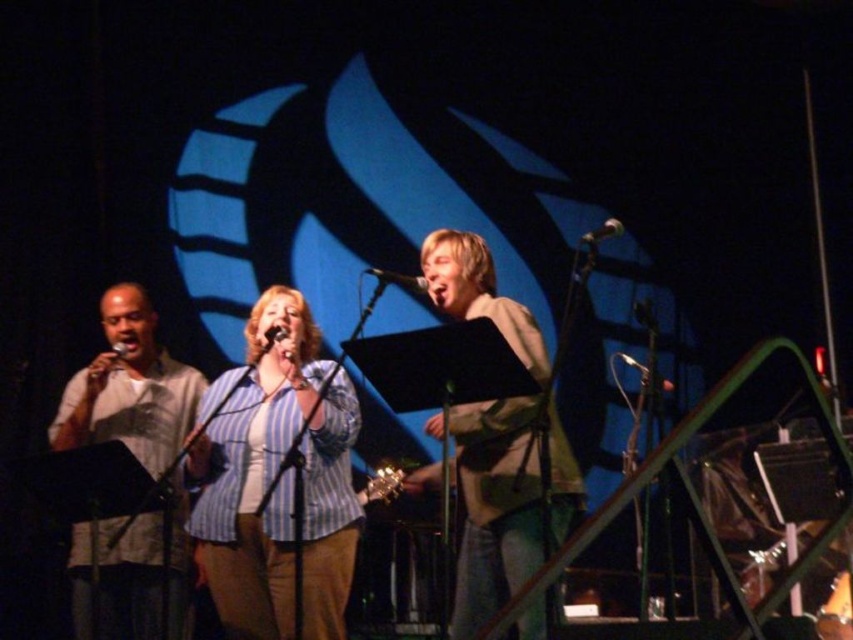
Is black matte microphone at center to the left of metallic silver microphone at upper center from the viewer's perspective?

Indeed, black matte microphone at center is positioned on the left side of metallic silver microphone at upper center.

Is black matte microphone at center positioned before metallic silver microphone at upper center?

→ No, black matte microphone at center is further to the viewer.

Does point (403, 285) come farther from viewer compared to point (579, 236)?

No, it is in front of (579, 236).

Image resolution: width=853 pixels, height=640 pixels. What are the coordinates of `black matte microphone at center` in the screenshot? It's located at pos(398,280).

Does light brown leather jacket at center appear on the left side of metallic shiny microphone at left?

No, light brown leather jacket at center is not to the left of metallic shiny microphone at left.

Is light brown leather jacket at center smaller than metallic shiny microphone at left?

Actually, light brown leather jacket at center might be larger than metallic shiny microphone at left.

Does point (445, 289) come farther from viewer compared to point (112, 348)?

No.

Where is `light brown leather jacket at center`? light brown leather jacket at center is located at coordinates click(495, 506).

Does point (518, 483) come in front of point (381, 282)?

Yes, it is in front of point (381, 282).

Is light brown leather jacket at center taller than black matte microphone at center?

Yes, light brown leather jacket at center is taller than black matte microphone at center.

The height and width of the screenshot is (640, 853). I want to click on light brown leather jacket at center, so click(495, 506).